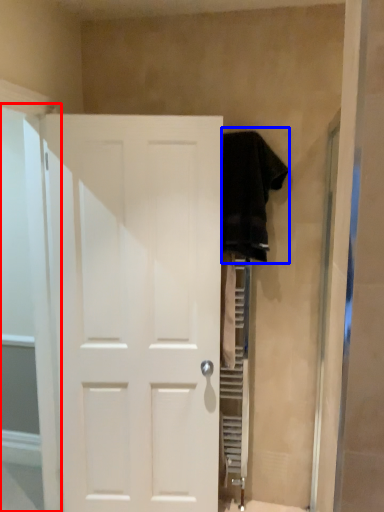
Question: Which of the following is the farthest to the observer, glass door (highlighted by a red box) or clothing (highlighted by a blue box)?

Choices:
 (A) glass door
 (B) clothing

Answer: (B)